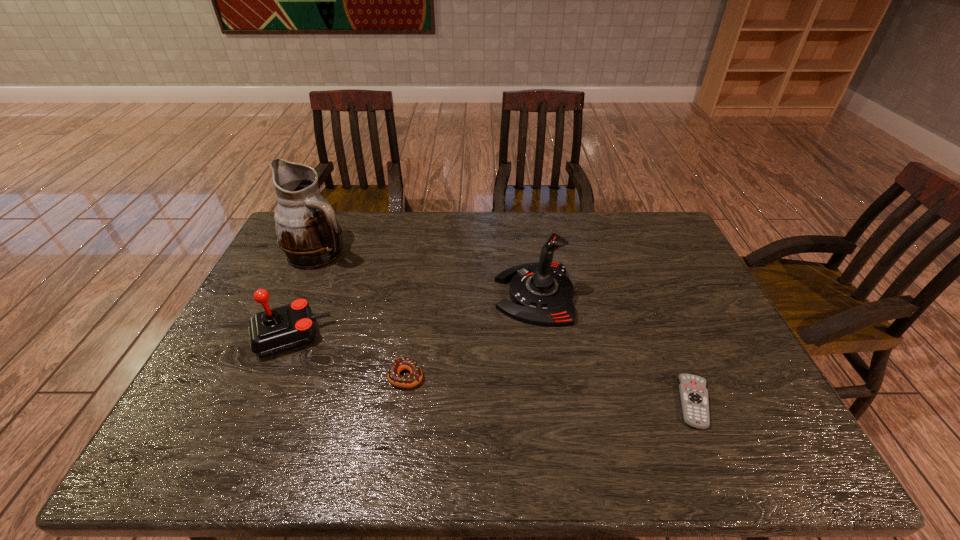
Where is `object located in the far left corner section of the desktop`? object located in the far left corner section of the desktop is located at coordinates (308, 233).

Where is `free space at the far edge of the desktop`? The height and width of the screenshot is (540, 960). free space at the far edge of the desktop is located at coordinates (572, 219).

I want to click on free space at the near edge, so click(x=371, y=437).

This screenshot has height=540, width=960. Find the location of `free space at the left edge`. free space at the left edge is located at coordinates (248, 401).

At what (x,y) coordinates should I click in order to perform the action: click on vacant space at the right edge of the desktop. Please return your answer as a coordinate pair (x, y). The image size is (960, 540). Looking at the image, I should click on (725, 357).

Locate an element on the screen. The width and height of the screenshot is (960, 540). vacant area at the far right corner of the desktop is located at coordinates (675, 237).

Locate an element on the screen. This screenshot has height=540, width=960. blank space at the near right corner of the desktop is located at coordinates (784, 454).

In order to click on free point between the fourth object from left to right and the tallest object in this screenshot , I will do `click(427, 274)`.

Identify the location of free space between the shorter joystick and the second tallest object. (413, 315).

At what (x,y) coordinates should I click in order to perform the action: click on free space between the shorter joystick and the doughnut. Please return your answer as a coordinate pair (x, y). Looking at the image, I should click on (348, 356).